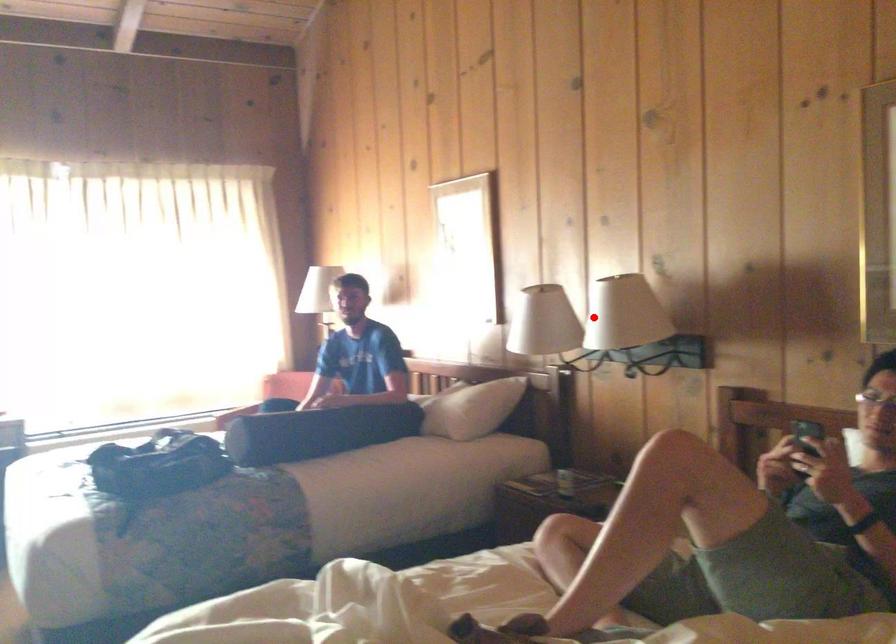
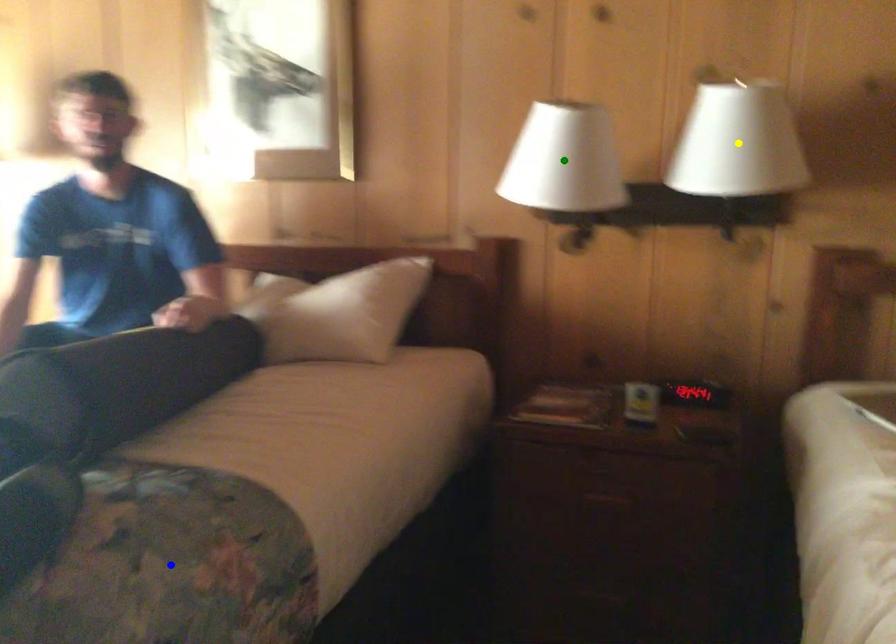
Question: I am providing you with two images of the same scene from different viewpoints. A red point is marked on the first image. You are given multiple points on the second image. Can you choose the point in image 2 that corresponds to the point in image 1?

Choices:
 (A) green point
 (B) yellow point
 (C) blue point

Answer: (B)